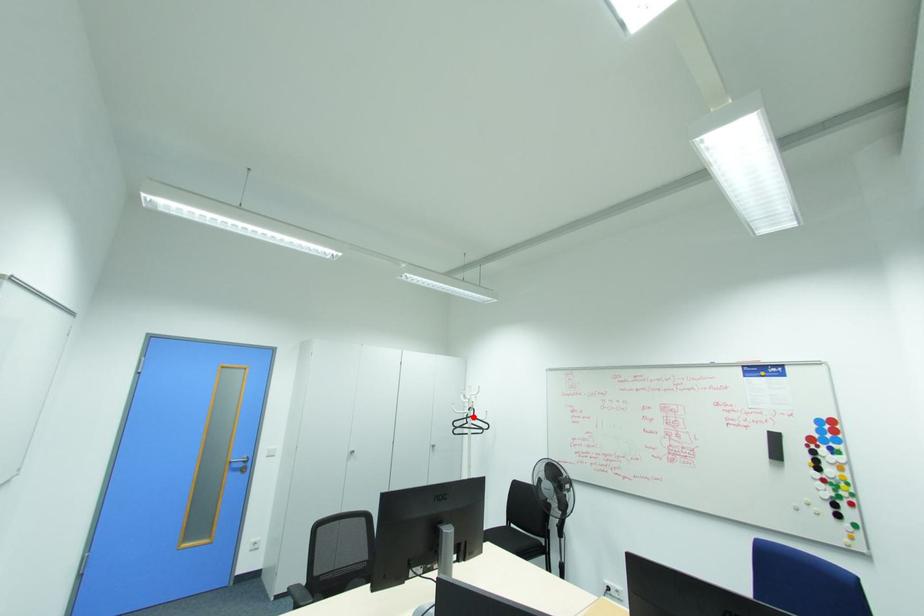
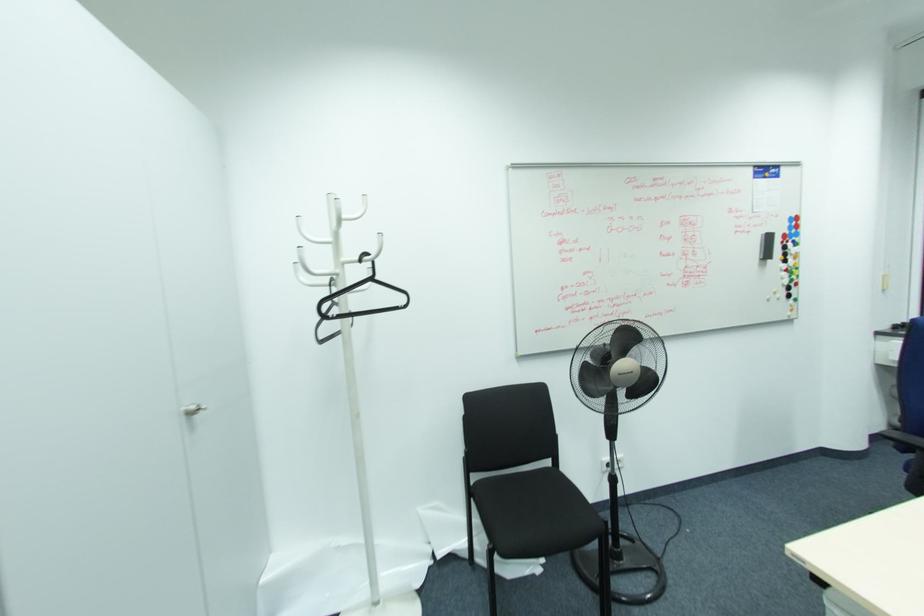
Question: I am providing you with two images of the same scene from different viewpoints. A red point is shown in image1. For the corresponding object point in image2, is it positioned nearer or farther from the camera?

Choices:
 (A) Nearer
 (B) Farther

Answer: (A)